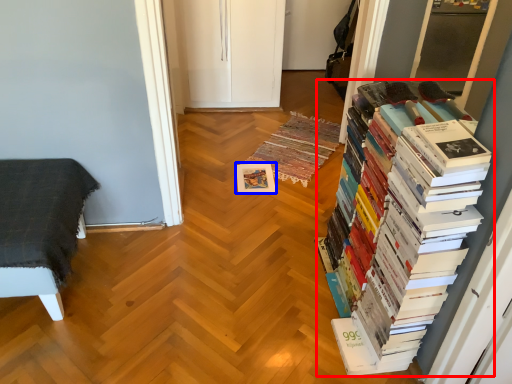
Question: Which point is closer to the camera, book (highlighted by a red box) or paperback book (highlighted by a blue box)?

Choices:
 (A) book
 (B) paperback book

Answer: (A)